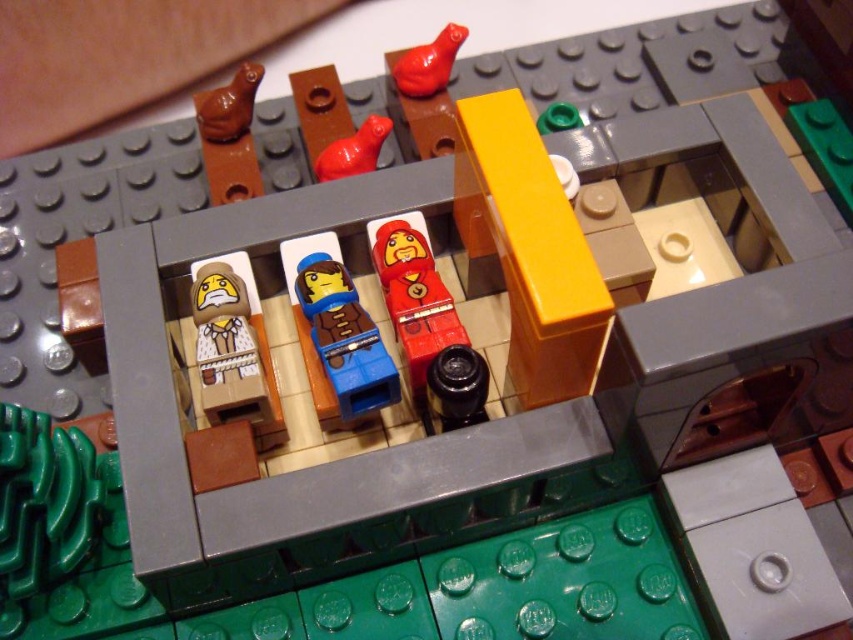
Question: Which of the following is the farthest from the observer?

Choices:
 (A) (350, 365)
 (B) (415, 56)
 (C) (378, 115)

Answer: (C)

Question: Does blue plastic figure at center have a smaller size compared to rubber duck at center?

Choices:
 (A) yes
 (B) no

Answer: (A)

Question: Among these objects, which one is nearest to the camera?

Choices:
 (A) brown matte minifigure at center-left
 (B) blue plastic figure at center
 (C) rubber duck at center
 (D) matte red bird at upper center

Answer: (B)

Question: Which object is closer to the camera taking this photo?

Choices:
 (A) blue plastic figure at center
 (B) rubber duck at center
 (C) brown matte minifigure at center-left
 (D) matte red bird at upper center

Answer: (A)

Question: Is blue plastic figure at center below matte red bird at upper center?

Choices:
 (A) no
 (B) yes

Answer: (B)

Question: Where is matte red bird at upper center located in relation to rubber duck at center in the image?

Choices:
 (A) above
 (B) below

Answer: (A)